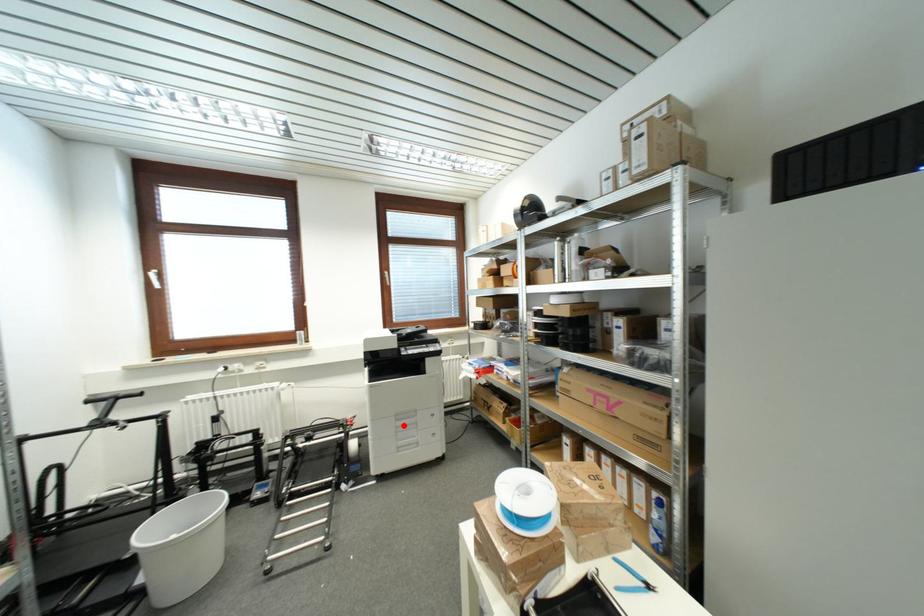
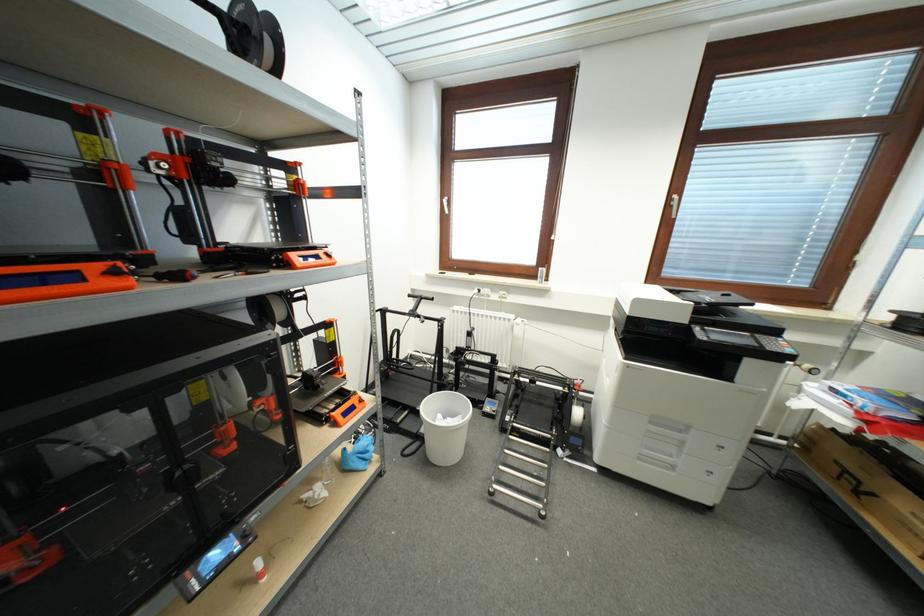
Find the pixel in the second image that matches the highlighted location in the first image.

(658, 431)